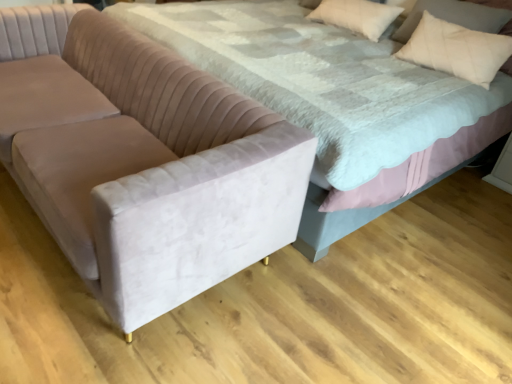
Question: From their relative heights in the image, would you say velvet couch at left is taller or shorter than white soft pillow at upper right?

Choices:
 (A) short
 (B) tall

Answer: (B)

Question: From the image's perspective, is velvet couch at left above or below white soft pillow at upper right?

Choices:
 (A) below
 (B) above

Answer: (A)

Question: Which object is positioned farthest from the white soft pillow at upper right?

Choices:
 (A) beige cotton pillow at upper right
 (B) velvet couch at left
 (C) velvet bed at center

Answer: (B)

Question: Considering the real-world distances, which object is closest to the beige cotton pillow at upper right?

Choices:
 (A) velvet bed at center
 (B) white soft pillow at upper right
 (C) velvet couch at left

Answer: (B)